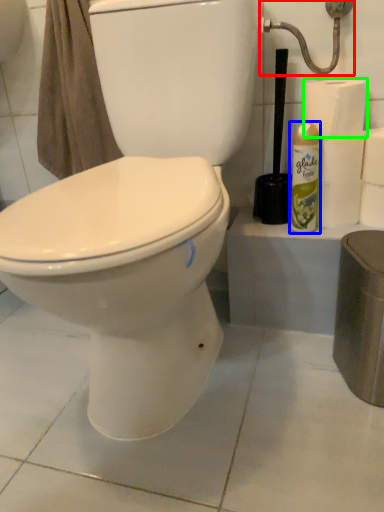
Question: Which object is positioned farthest from shower (highlighted by a red box)? Select from cleaning product (highlighted by a blue box) and toilet paper (highlighted by a green box).

Choices:
 (A) cleaning product
 (B) toilet paper

Answer: (A)